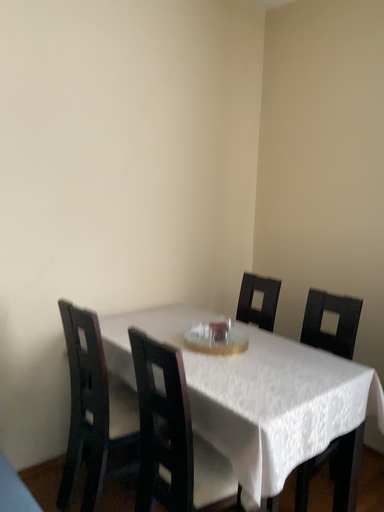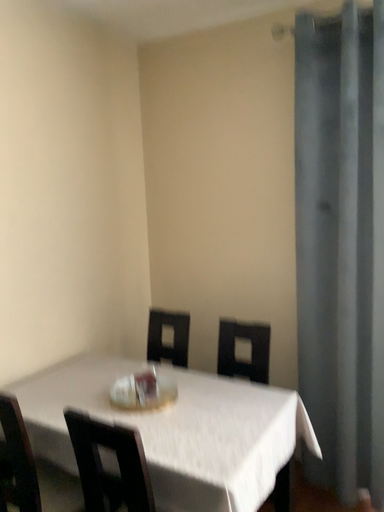
Question: How did the camera likely rotate when shooting the video?

Choices:
 (A) rotated left
 (B) rotated right

Answer: (B)